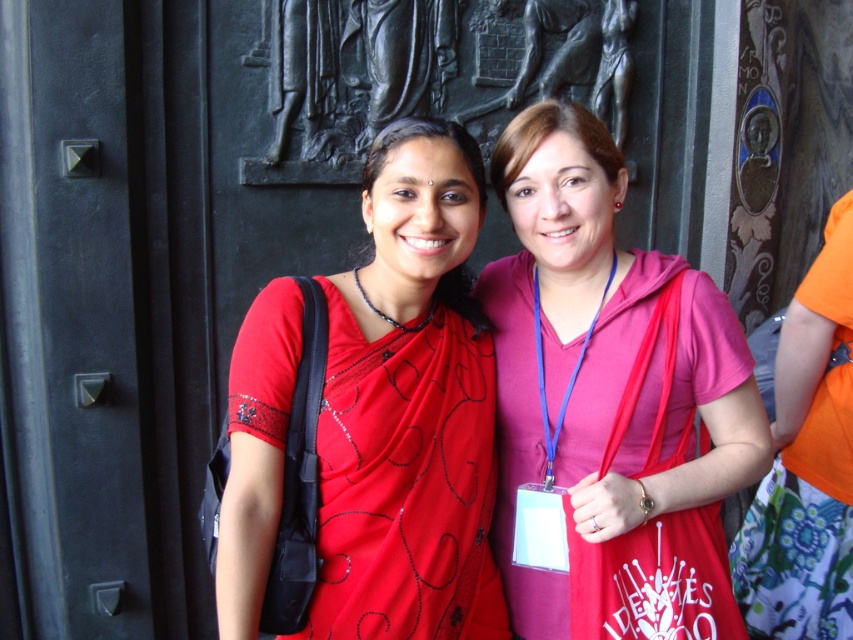
You are taking a photo of the matte red sari at center and the black metal door at center. Which object will appear larger in your photo?

The matte red sari at center will appear larger in the photo because it is closer to the viewer than the black metal door at center.

From the picture: You are an interior designer assessing the space in front of the black metal door at center. You notice the pink fabric at center hanging nearby. Which object occupies more horizontal space in the scene?

The pink fabric at center has a greater width than the black metal door at center, so it occupies more horizontal space in the scene.